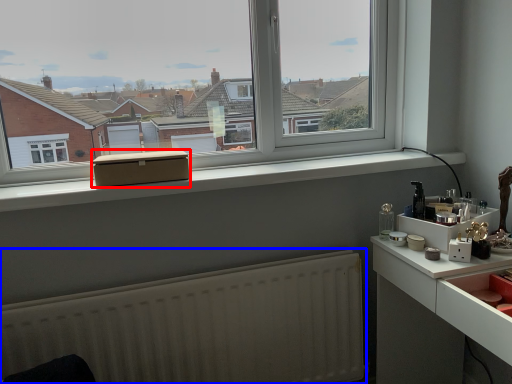
Question: Which object is further to the camera taking this photo, box (highlighted by a red box) or radiator (highlighted by a blue box)?

Choices:
 (A) box
 (B) radiator

Answer: (A)